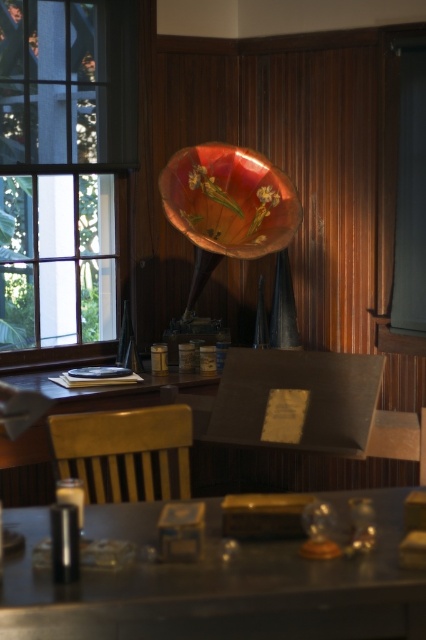
Question: Does clear glass window at left come in front of metallic silver table at center?

Choices:
 (A) no
 (B) yes

Answer: (A)

Question: Based on their relative distances, which object is nearer to the wooden chair at center?

Choices:
 (A) metallic silver table at center
 (B) clear glass window at left

Answer: (A)

Question: Observing the image, what is the correct spatial positioning of clear glass window at left in reference to wooden chair at center?

Choices:
 (A) right
 (B) left

Answer: (B)

Question: Which object appears farthest from the camera in this image?

Choices:
 (A) clear glass window at left
 (B) metallic silver table at center
 (C) wooden chair at center

Answer: (A)

Question: Which object appears closest to the camera in this image?

Choices:
 (A) wooden chair at center
 (B) clear glass window at left
 (C) metallic silver table at center

Answer: (C)

Question: Can you confirm if clear glass window at left is positioned to the right of wooden chair at center?

Choices:
 (A) no
 (B) yes

Answer: (A)